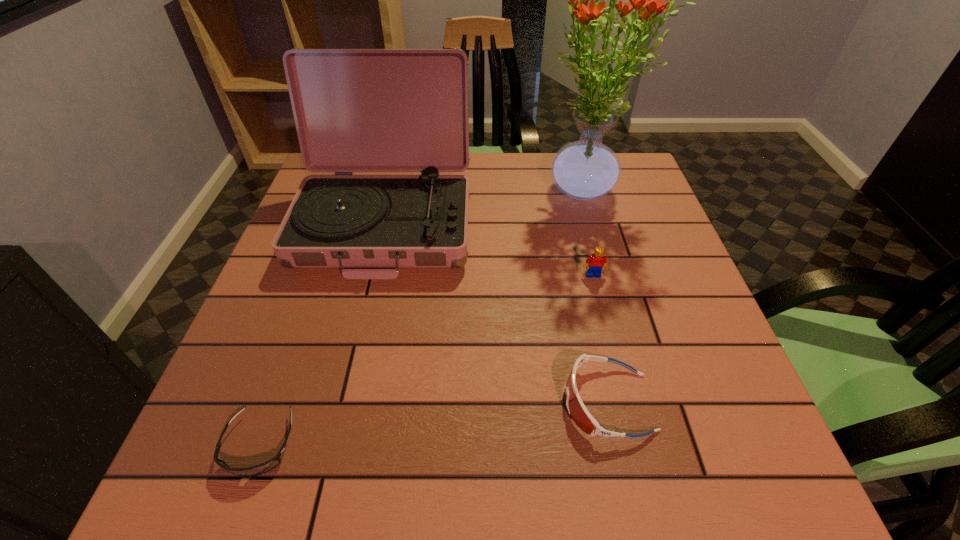
Locate an element on the screen. Image resolution: width=960 pixels, height=540 pixels. empty space between the third tallest object and the right goggles is located at coordinates (600, 339).

Image resolution: width=960 pixels, height=540 pixels. I want to click on free space between the second tallest object and the left goggles, so click(x=323, y=334).

What are the coordinates of `vacant space that is in between the third tallest object and the taller goggles` in the screenshot? It's located at pos(600,339).

The height and width of the screenshot is (540, 960). I want to click on free space between the flower arrangement and the third tallest object, so click(x=588, y=233).

Locate an element on the screen. This screenshot has height=540, width=960. free space between the left goggles and the flower arrangement is located at coordinates (421, 318).

Find the location of `free space that is in between the taller goggles and the second tallest object`. free space that is in between the taller goggles and the second tallest object is located at coordinates (496, 313).

What are the coordinates of `free space between the right goggles and the flower arrangement` in the screenshot? It's located at (595, 296).

This screenshot has width=960, height=540. I want to click on unoccupied position between the right goggles and the left goggles, so click(434, 423).

Identify which object is the closest to the flower arrangement. Please provide its 2D coordinates. Your answer should be formatted as a tuple, i.e. [(x, y)], where the tuple contains the x and y coordinates of a point satisfying the conditions above.

[(597, 261)]

Where is `object that stands as the second closest to the Lego`? The width and height of the screenshot is (960, 540). object that stands as the second closest to the Lego is located at coordinates (576, 408).